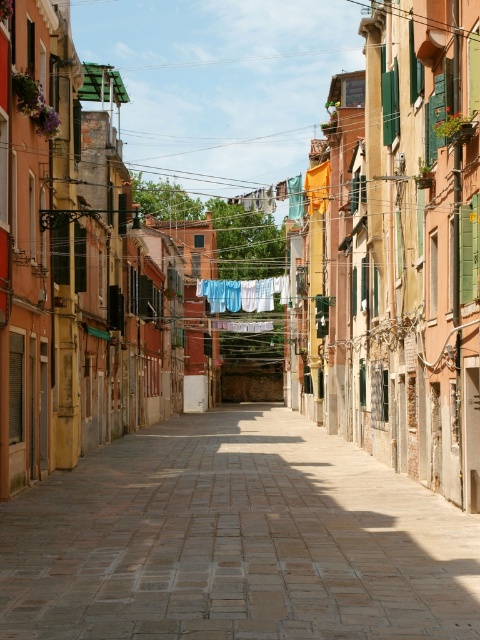
You are standing at the entrance of a historic street and see the brick paved alley at center and the blue fabric at center. Which object is closer to you?

The brick paved alley at center is closer to you since it is only 40.76 meters away from the blue fabric at center, meaning it is nearer than the blue fabric.

Looking at this image, you are standing on the brick paved alley at center and looking towards the blue fabric at center. Which object is closer to you?

The brick paved alley at center is closer to you than the blue fabric at center.